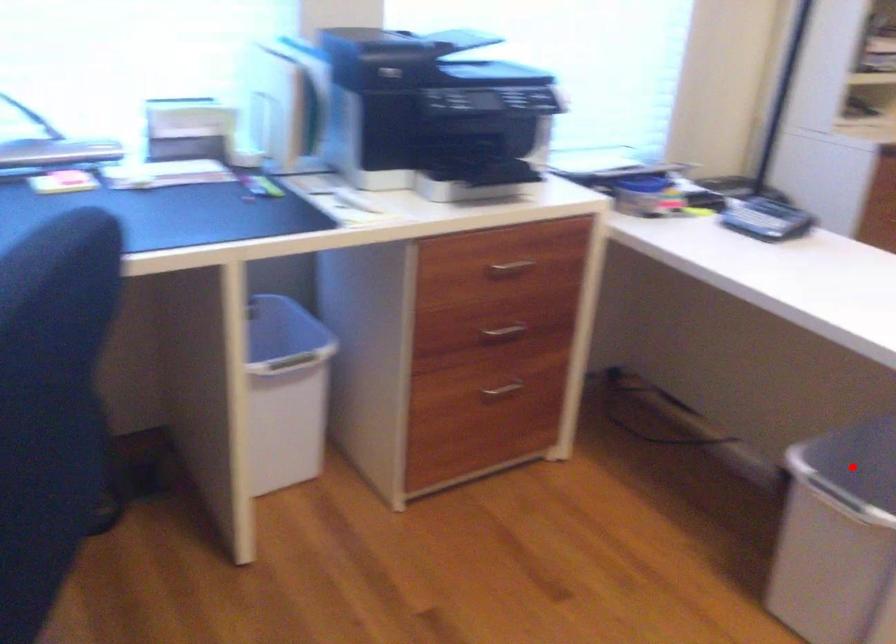
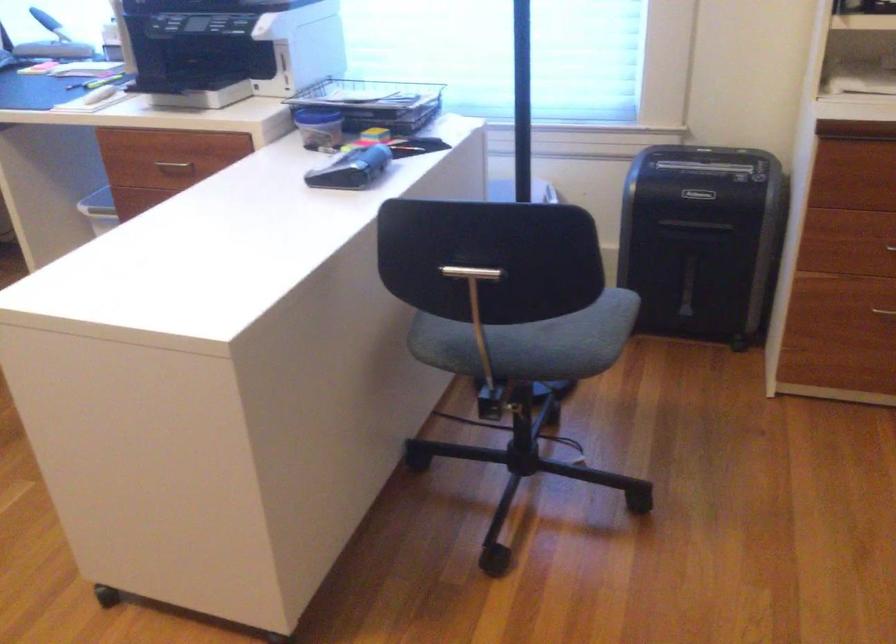
Question: I am providing you with two images of the same scene from different viewpoints. A red point is marked on the first image. Can you still see the location of the red point in image 2?

Choices:
 (A) Yes
 (B) No

Answer: (B)